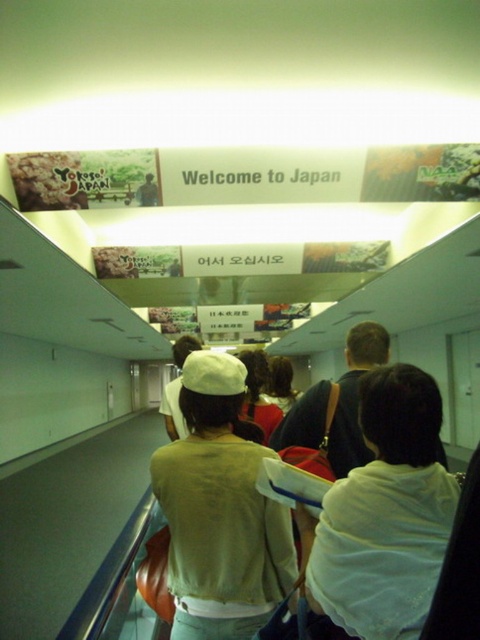
Does white fabric shirt at center have a lesser width compared to light beige sweater at center?

Yes, white fabric shirt at center is thinner than light beige sweater at center.

Does point (403, 540) come closer to viewer compared to point (227, 429)?

Yes.

You are a GUI agent. You are given a task and a screenshot of the screen. Output one action in this format:
    pyautogui.click(x=<x>, y=<y>)
    Task: Click on the white fabric shirt at center
    This screenshot has height=640, width=480.
    Given the screenshot: What is the action you would take?
    pyautogui.click(x=385, y=513)